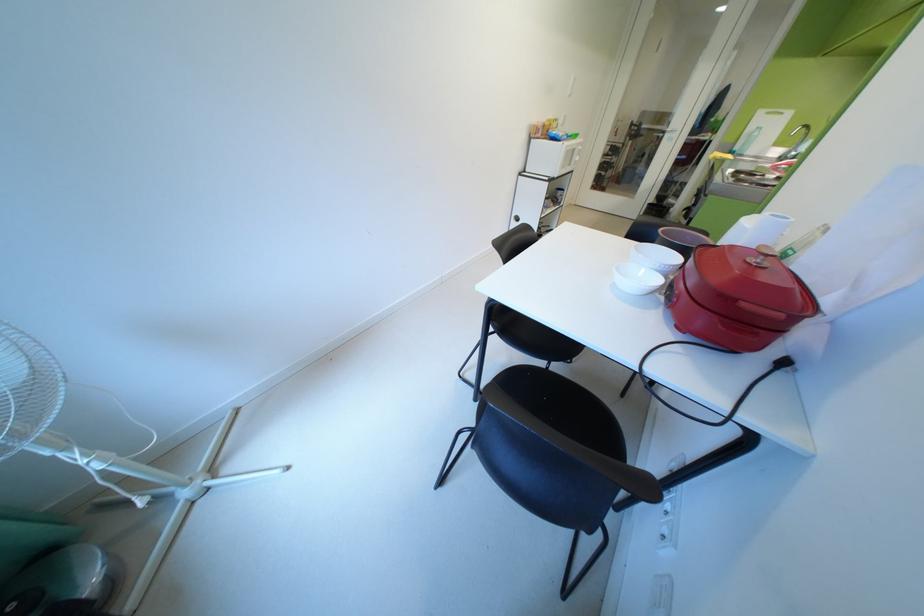
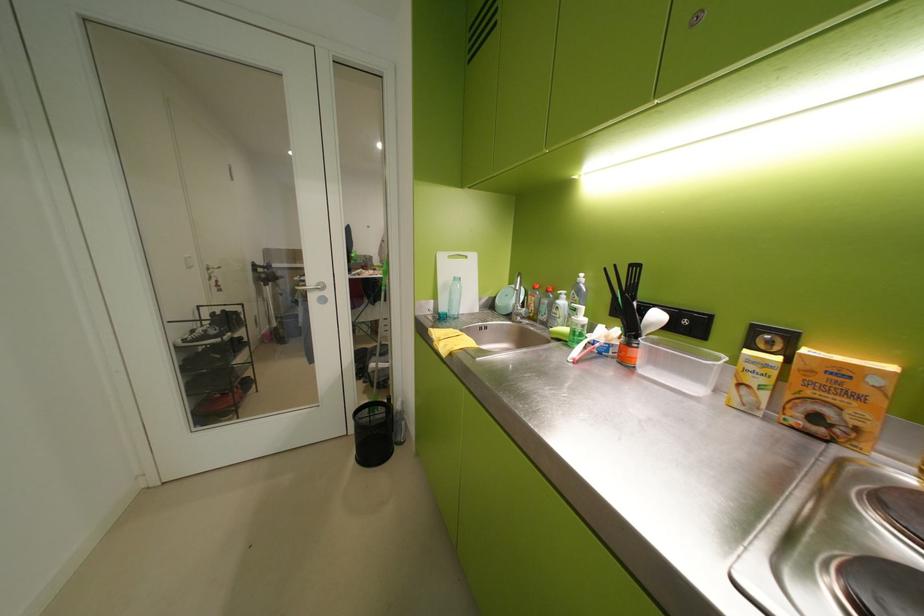
Find the pixel in the second image that matches (x=772, y=114) in the first image.

(453, 259)